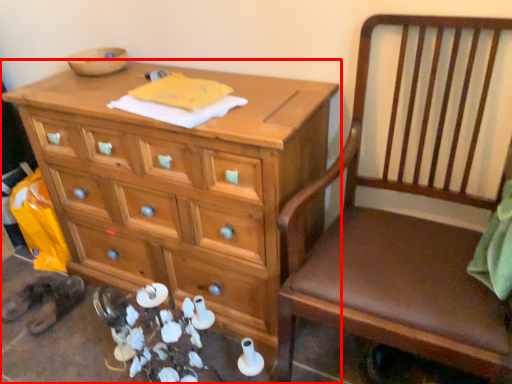
Question: From the image's perspective, what is the correct spatial relationship of chest of drawers (annotated by the red box) in relation to chair?

Choices:
 (A) below
 (B) above

Answer: (B)